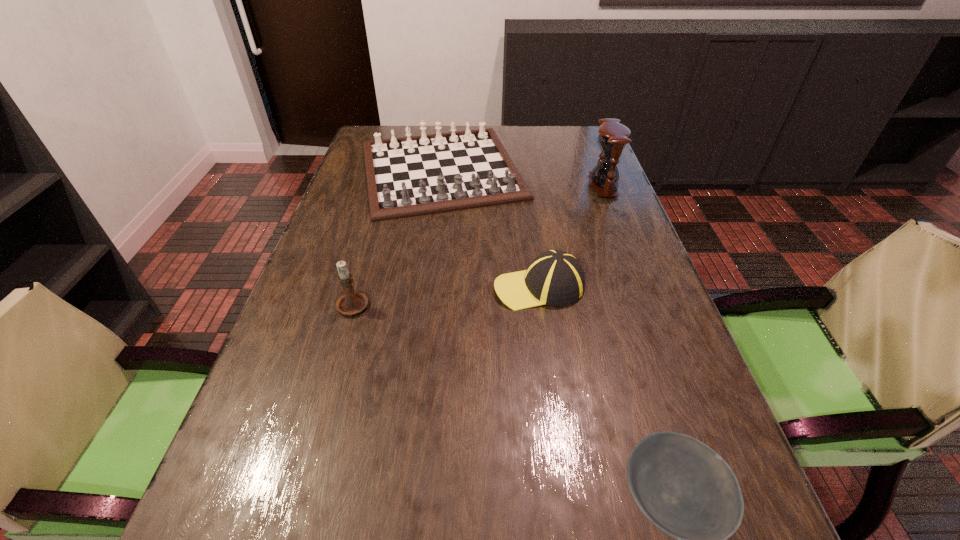
The width and height of the screenshot is (960, 540). Find the location of `free spot that satisfies the following two spatial constraints: 1. on the side of the chessboard with the handle; 2. on the right side of the candle holder`. free spot that satisfies the following two spatial constraints: 1. on the side of the chessboard with the handle; 2. on the right side of the candle holder is located at coordinates (392, 170).

Identify the location of free space in the image that satisfies the following two spatial constraints: 1. on the side of the second tallest object with the handle; 2. on the left side of the hourglass. (388, 185).

Where is `free space in the image that satisfies the following two spatial constraints: 1. on the side of the chessboard with the handle; 2. on the left side of the candle holder`? free space in the image that satisfies the following two spatial constraints: 1. on the side of the chessboard with the handle; 2. on the left side of the candle holder is located at coordinates (392, 170).